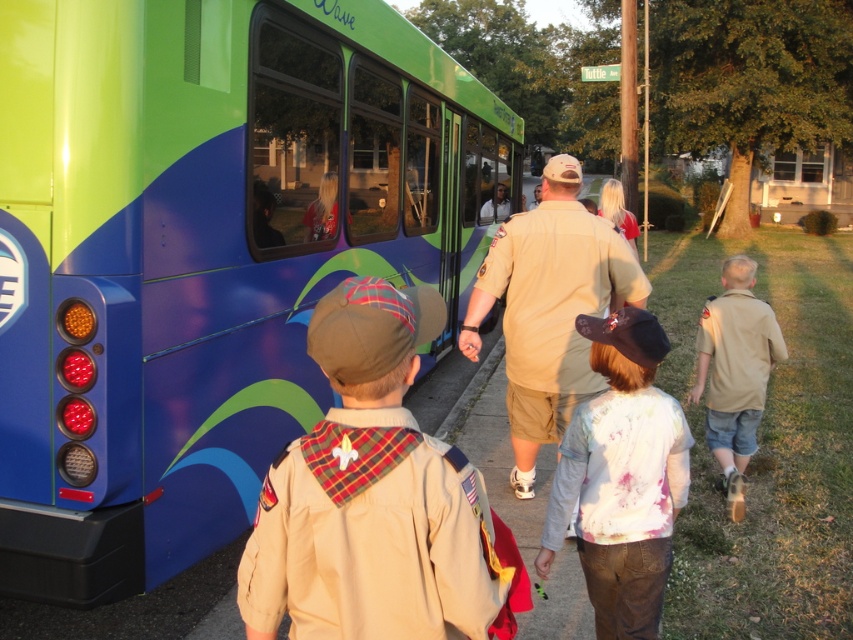
You are a photographer standing near the bus and want to take a photo of both the tan uniform at center and the shiny red jacket at bus window in the same frame. Can you fit both subjects into the photo without moving your position?

The tan uniform at center and the shiny red jacket at bus window are 3.95 feet apart. Since the distance between them is less than the typical camera frame width, you can fit both subjects into the photo without moving your position.

You are standing in front of the bus and see two points marked on the bus. Which point is closer to you, point (553,305) or point (693,403)?

Point (553,305) is closer to the viewer than point (693,403).